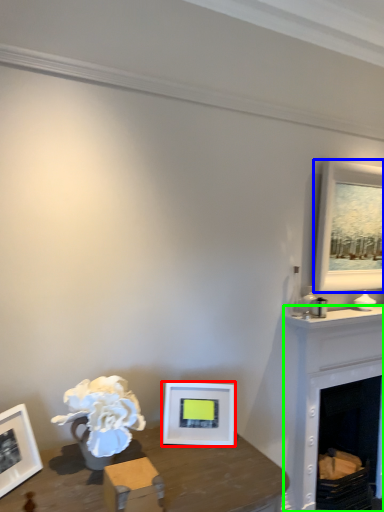
Question: Which object is positioned farthest from picture frame (highlighted by a red box)? Select from picture frame (highlighted by a blue box) and fireplace (highlighted by a green box).

Choices:
 (A) picture frame
 (B) fireplace

Answer: (A)